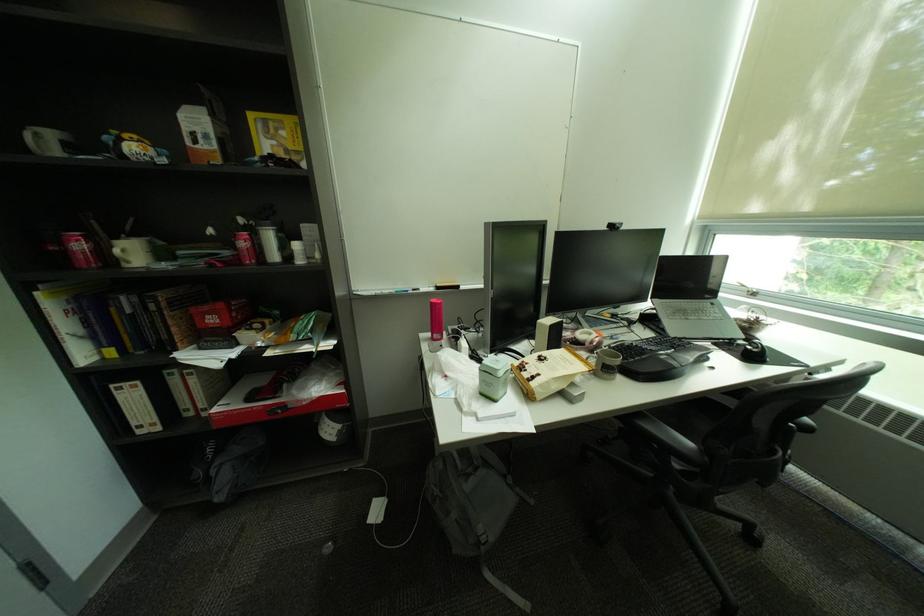
Describe the element at coordinates (754, 351) in the screenshot. I see `the black computer mouse` at that location.